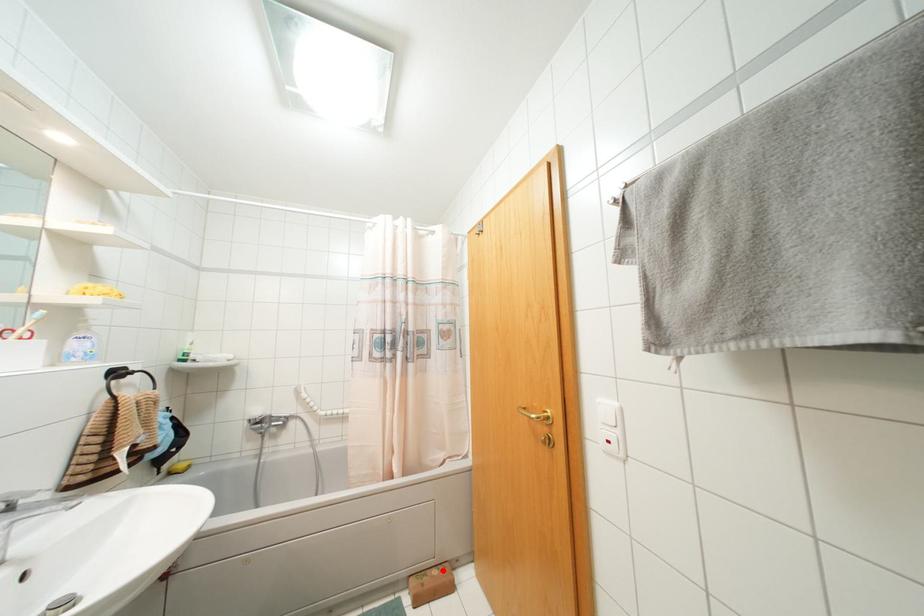
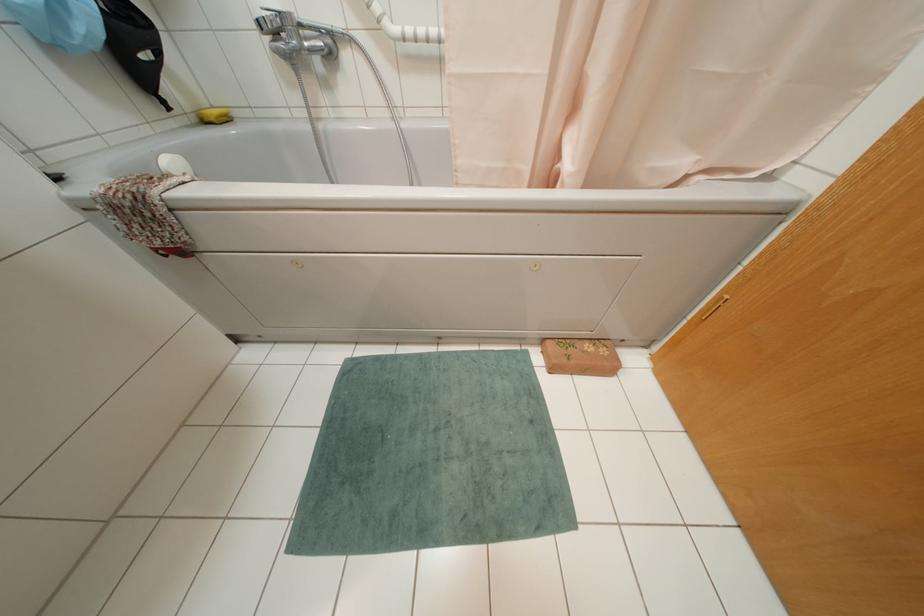
Question: I am providing you with two images of the same scene from different viewpoints. A red point is shown in image1. For the corresponding object point in image2, is it positioned nearer or farther from the camera?

Choices:
 (A) Nearer
 (B) Farther

Answer: (A)